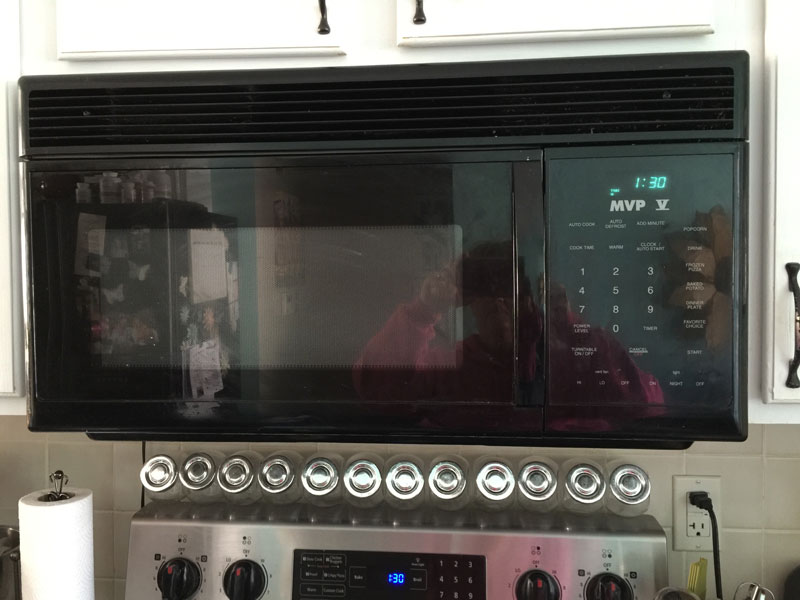
At what (x,y) coordinates should I click in order to perform the action: click on paper towels. Please return your answer as a coordinate pair (x, y). Looking at the image, I should click on (68, 558).